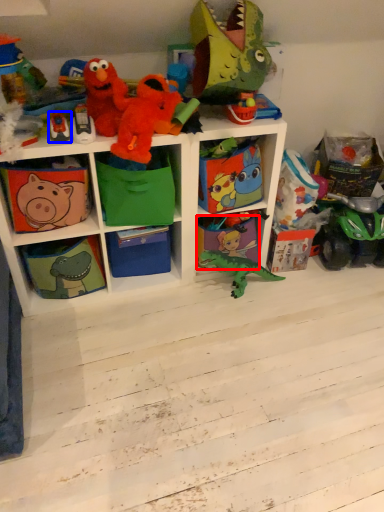
Question: Which point is closer to the camera, shelf (highlighted by a red box) or toy (highlighted by a blue box)?

Choices:
 (A) shelf
 (B) toy

Answer: (B)